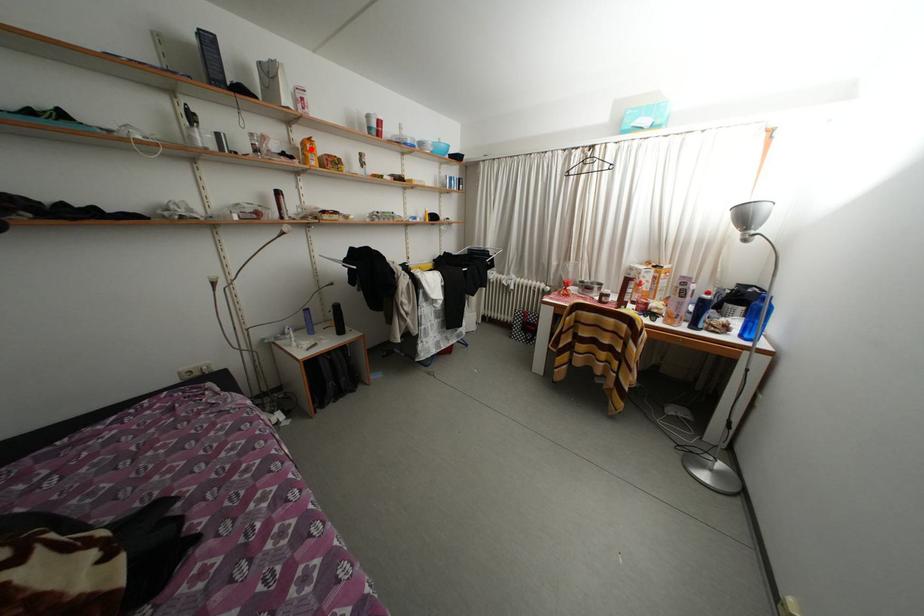
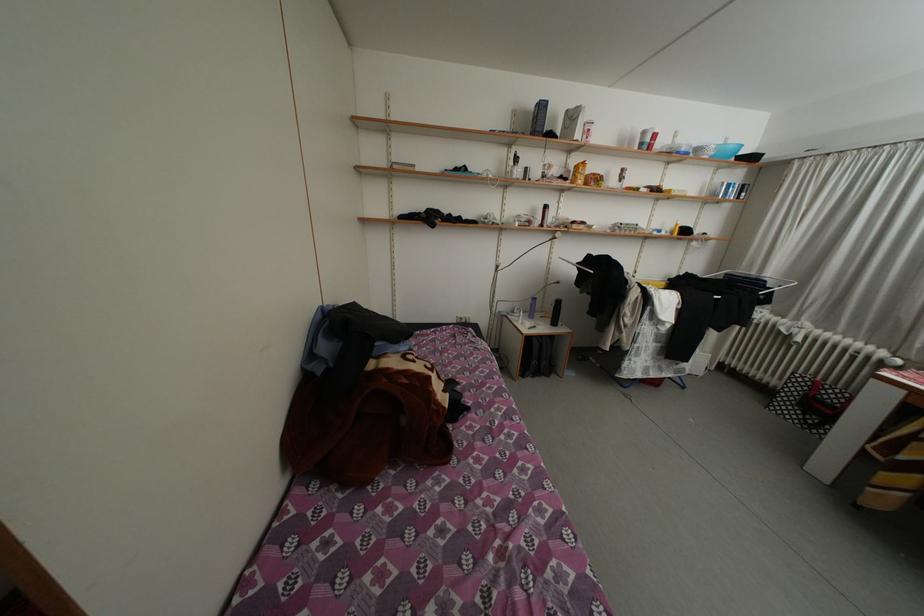
Locate, in the second image, the point that corresponds to the highlighted location in the first image.

(584, 172)